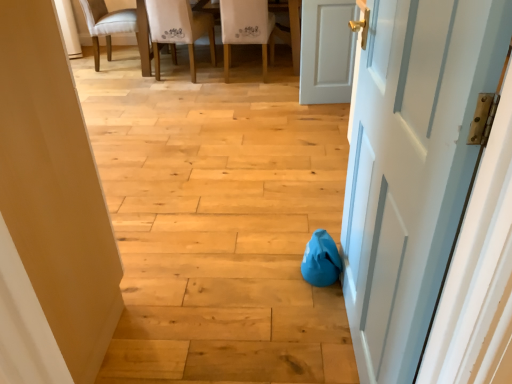
You are a GUI agent. You are given a task and a screenshot of the screen. Output one action in this format:
    pyautogui.click(x=<x>, y=<y>)
    Task: Click on the vacant area that lies between white fabric chair at upper center, which ranks as the 3th chair in left-to-right order, and white painted wood door at right, which is the first door in front-to-back order
    The width and height of the screenshot is (512, 384).
    Given the screenshot: What is the action you would take?
    pyautogui.click(x=279, y=151)